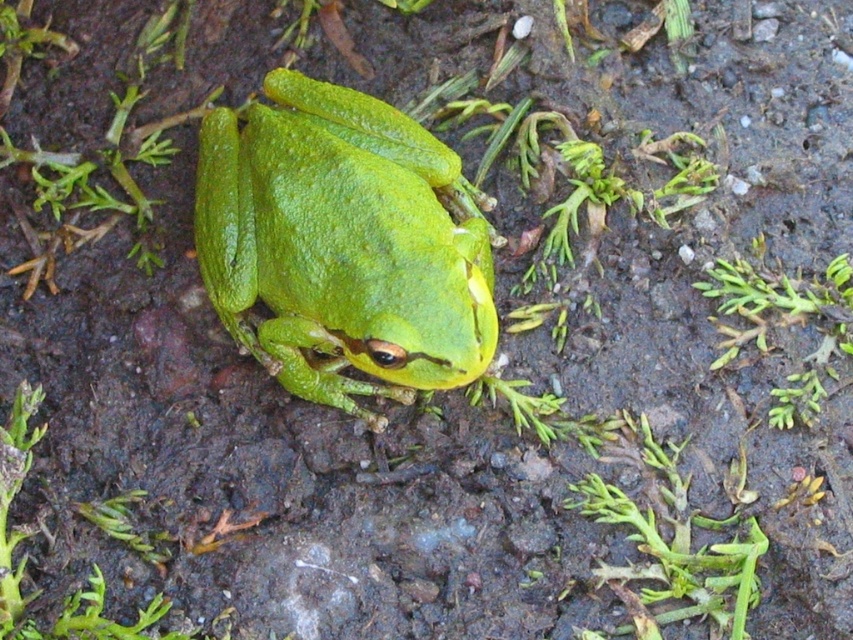
You are a photographer aiming to capture the green matte tree frog at center and the green leafy weed at lower left in a single frame. Which object is located to the right of the other?

The green matte tree frog at center is positioned on the right side of green leafy weed at lower left.

You are observing a frog in a natural setting. The frog is at the center of the image. There is a point marked at coordinates [343,244]. Can you confirm if the green matte tree frog at center is exactly at that point?

The green matte tree frog at center is located at point [343,244], so yes, the frog is exactly at that point.

You are a gardener trying to locate the green leafy weed at lower left in the soil. You see the green matte tree frog at center. Which direction should you look relative to the frog to find the weed?

The green leafy weed at lower left is located below the green matte tree frog at center, so you should look downward from the frog to find the weed.